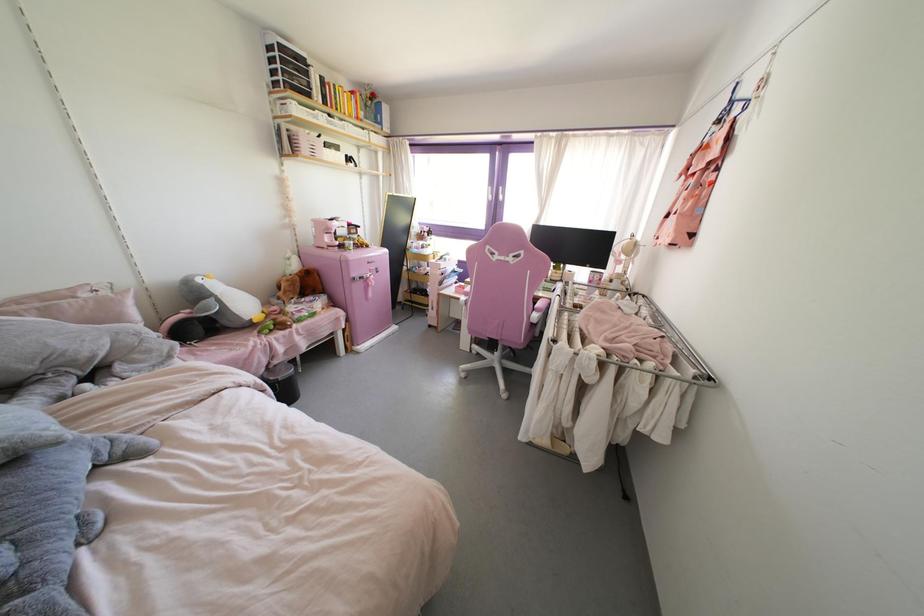
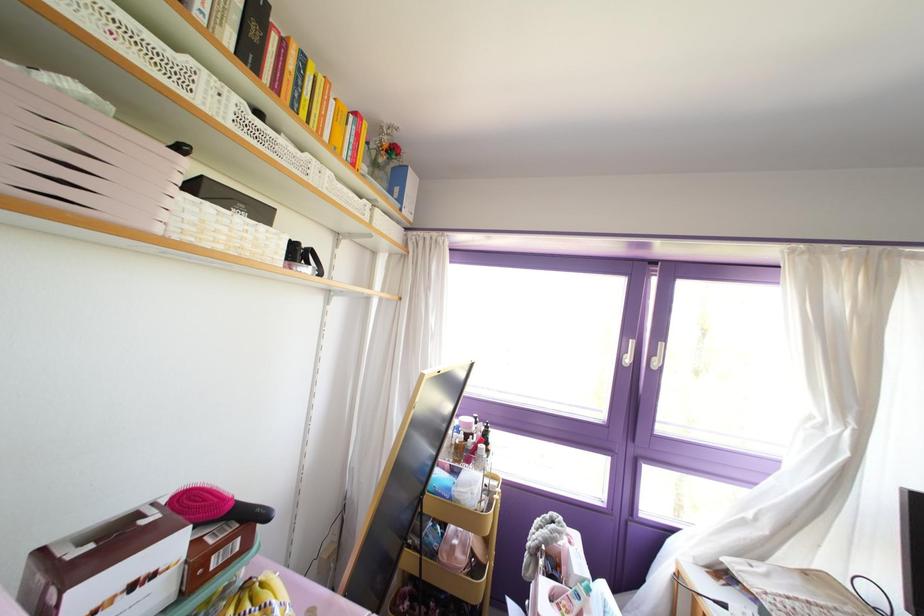
Find the pixel in the second image that matches (333,151) in the first image.

(237, 219)